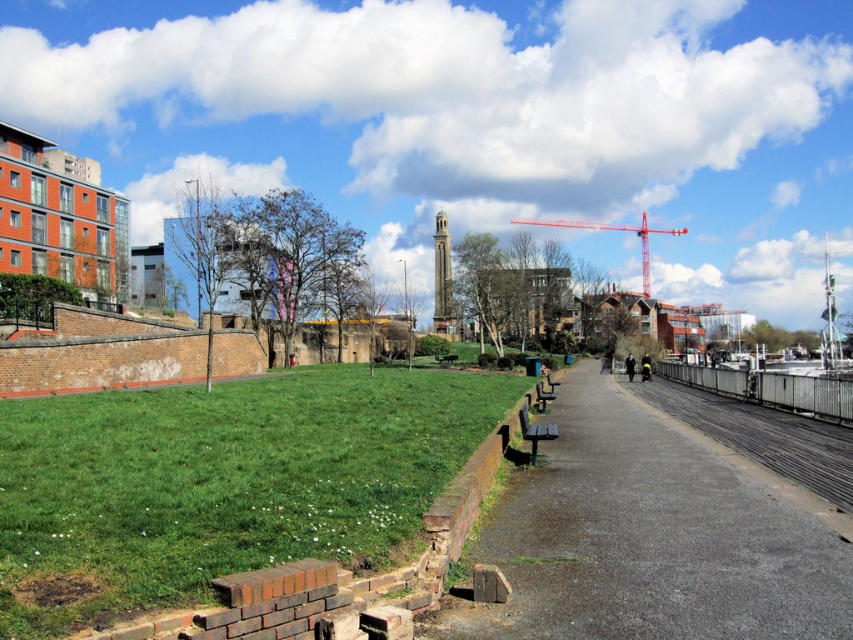
Question: Does asphalt pavement at center have a greater width compared to red metal crane at upper right?

Choices:
 (A) yes
 (B) no

Answer: (B)

Question: Which object is farther from the camera taking this photo?

Choices:
 (A) green grass at lower left
 (B) asphalt pavement at center

Answer: (B)

Question: Does asphalt pavement at center have a smaller size compared to black rubber train track at right?

Choices:
 (A) no
 (B) yes

Answer: (B)

Question: Among these points, which one is farthest from the camera?

Choices:
 (A) 328,490
 (B) 718,404
 (C) 506,630
 (D) 641,291

Answer: (D)

Question: Estimate the real-world distances between objects in this image. Which object is closer to the red metal crane at upper right?

Choices:
 (A) asphalt pavement at center
 (B) black rubber train track at right

Answer: (B)

Question: Can you confirm if asphalt pavement at center is positioned to the left of black rubber train track at right?

Choices:
 (A) yes
 (B) no

Answer: (A)